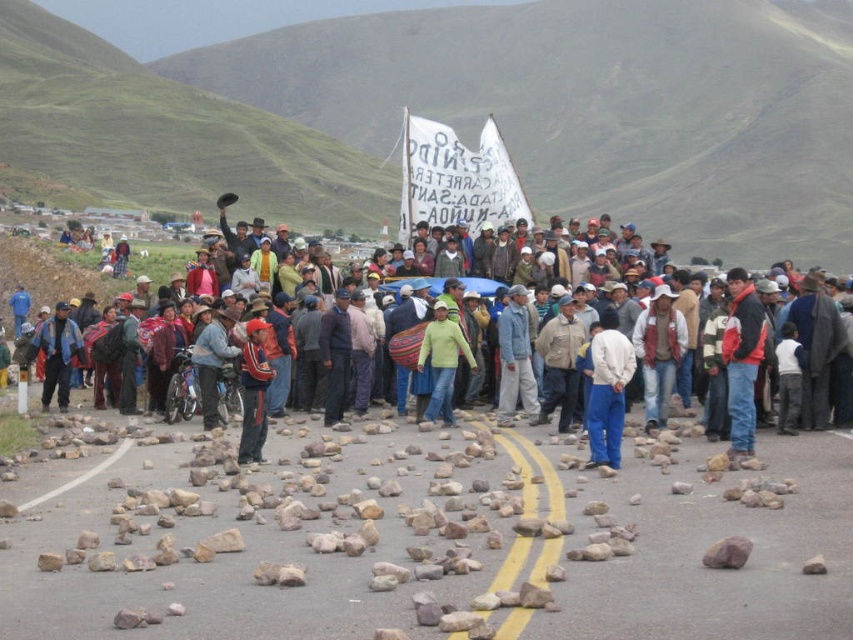
You are a photographer standing at the edge of the road, aiming to capture the protest scene. You notice the red jacket at center and the white matte pants at center. Which of these two items is wider in your camera frame?

The red jacket at center is wider than the white matte pants at center in the camera frame.

You are a photographer standing at the edge of the road. You see the red jacket at center and the white matte pants at center in your viewfinder. Which one appears taller in the frame?

The red jacket at center appears taller than the white matte pants at center in the frame.

You are a hiker trying to reach the trailhead located beyond the roadblock. You see the white cotton shirt at center and the red fabric backpack at center. Which object is closer to you as you approach the roadblock?

The white cotton shirt at center is closer to you because the red fabric backpack at center is behind it, meaning the shirt is in front.